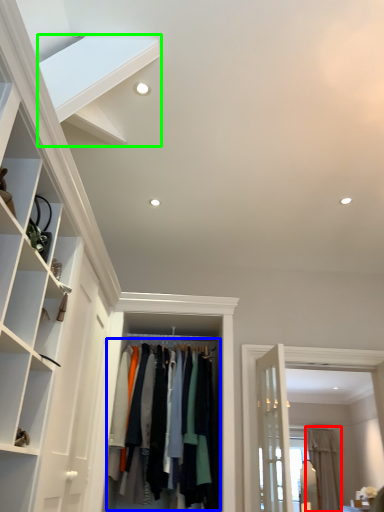
Question: Which is farther away from curtain (highlighted by a red box)? clothing (highlighted by a blue box) or stairs (highlighted by a green box)?

Choices:
 (A) clothing
 (B) stairs

Answer: (B)